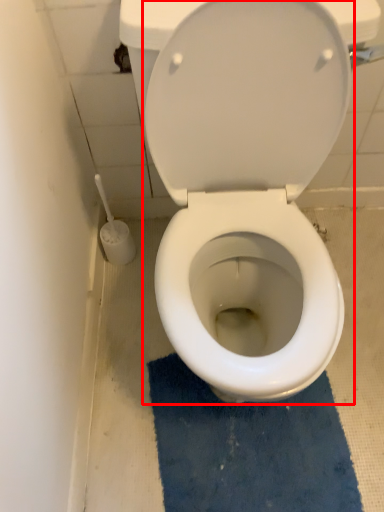
Question: From the image's perspective, considering the relative positions of toilet (annotated by the red box) and bath mat in the image provided, where is toilet (annotated by the red box) located with respect to the staircase?

Choices:
 (A) below
 (B) above

Answer: (B)